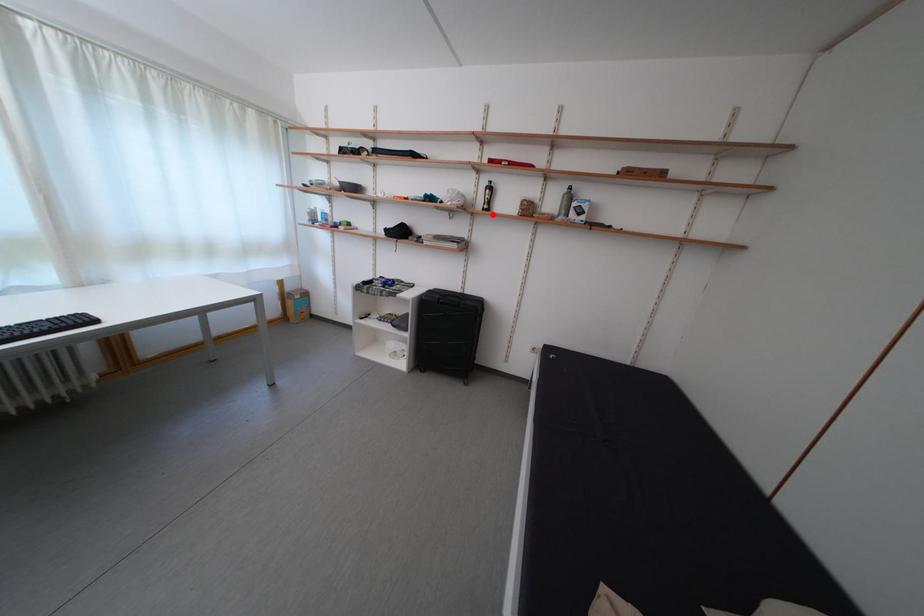
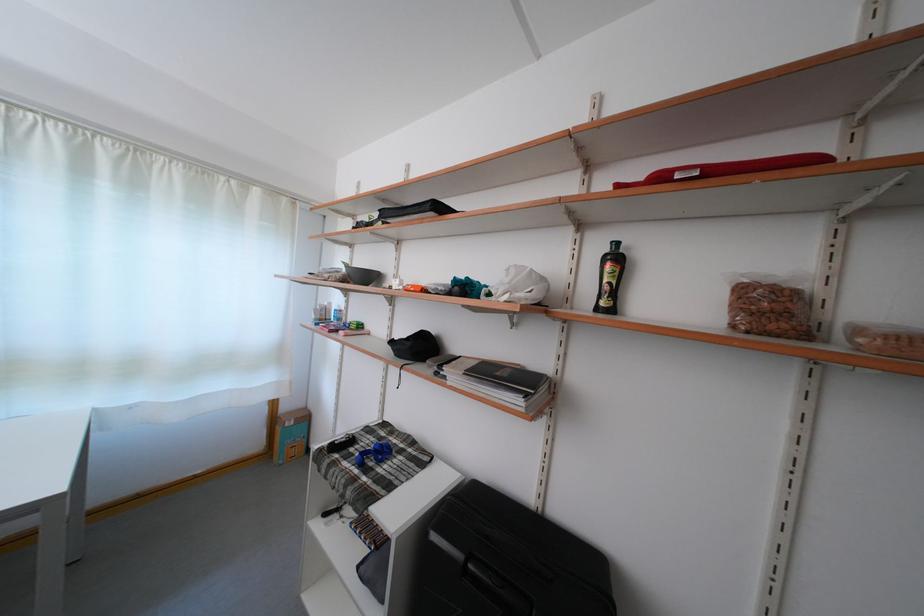
Where in the second image is the point corresponding to the highlighted location from the first image?

(606, 314)